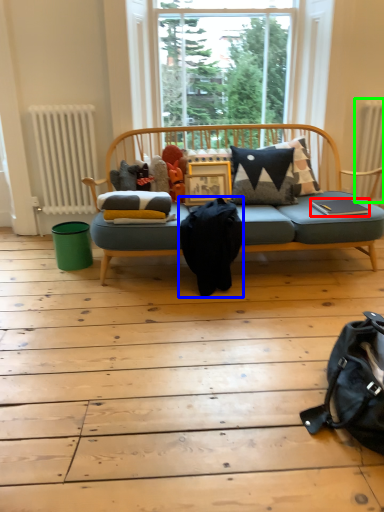
Question: Considering the real-world distances, which object is closest to book (highlighted by a red box)? messenger bag (highlighted by a blue box) or radiator (highlighted by a green box).

Choices:
 (A) messenger bag
 (B) radiator

Answer: (B)